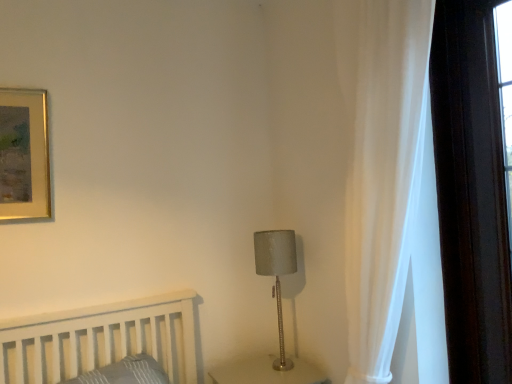
Question: Can you confirm if white sheer curtain at right is bigger than satin gray lampshade at center-right?

Choices:
 (A) no
 (B) yes

Answer: (B)

Question: From the image's perspective, is white sheer curtain at right beneath satin gray lampshade at center-right?

Choices:
 (A) no
 (B) yes

Answer: (A)

Question: Considering the relative positions of white sheer curtain at right and satin gray lampshade at center-right in the image provided, is white sheer curtain at right in front of satin gray lampshade at center-right?

Choices:
 (A) no
 (B) yes

Answer: (B)

Question: Is white sheer curtain at right not within satin gray lampshade at center-right?

Choices:
 (A) no
 (B) yes

Answer: (B)

Question: Is white sheer curtain at right oriented towards satin gray lampshade at center-right?

Choices:
 (A) no
 (B) yes

Answer: (A)

Question: Are white sheer curtain at right and satin gray lampshade at center-right making contact?

Choices:
 (A) yes
 (B) no

Answer: (B)

Question: From a real-world perspective, is satin gray lampshade at center-right positioned under white sheer curtain at right based on gravity?

Choices:
 (A) no
 (B) yes

Answer: (B)

Question: From the image's perspective, is satin gray lampshade at center-right located beneath white sheer curtain at right?

Choices:
 (A) yes
 (B) no

Answer: (A)

Question: Considering the relative sizes of satin gray lampshade at center-right and white sheer curtain at right in the image provided, is satin gray lampshade at center-right shorter than white sheer curtain at right?

Choices:
 (A) yes
 (B) no

Answer: (A)

Question: Is white sheer curtain at right located within satin gray lampshade at center-right?

Choices:
 (A) no
 (B) yes

Answer: (A)

Question: Are satin gray lampshade at center-right and white sheer curtain at right far apart?

Choices:
 (A) no
 (B) yes

Answer: (A)

Question: Is satin gray lampshade at center-right positioned with its back to white sheer curtain at right?

Choices:
 (A) no
 (B) yes

Answer: (A)

Question: From the image's perspective, relative to white sheer curtain at right, is satin gray lampshade at center-right above or below?

Choices:
 (A) below
 (B) above

Answer: (A)